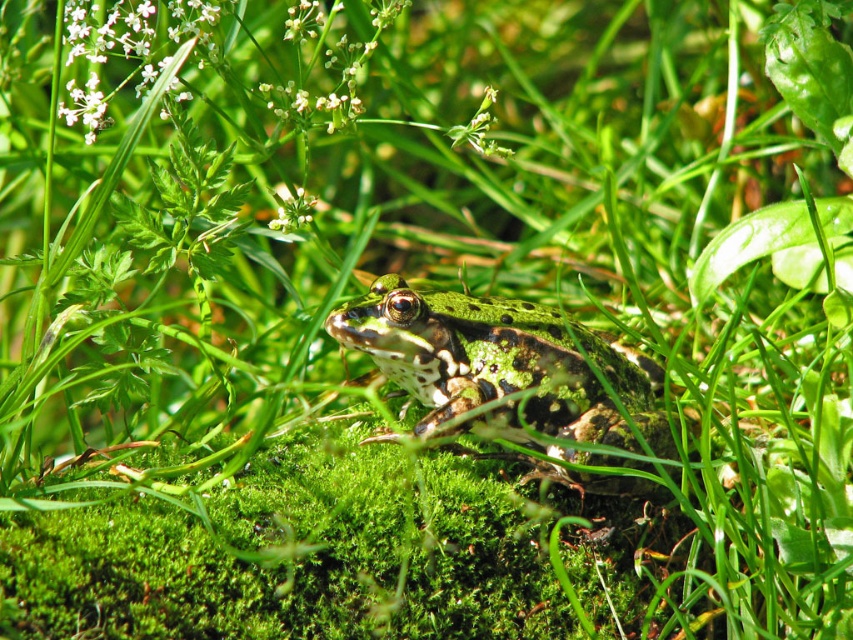
Question: Which point appears farthest from the camera in this image?

Choices:
 (A) (300, 212)
 (B) (555, 468)
 (C) (73, 12)

Answer: (A)

Question: Which point is farther to the camera?

Choices:
 (A) white fluffy flower at upper left
 (B) green spotted skin at center
 (C) green matte flower at upper center

Answer: (C)

Question: Does green spotted skin at center appear over green matte flower at upper center?

Choices:
 (A) yes
 (B) no

Answer: (B)

Question: Which object appears closest to the camera in this image?

Choices:
 (A) green spotted skin at center
 (B) white fluffy flower at upper left
 (C) green matte flower at upper center

Answer: (A)

Question: Does green spotted skin at center appear over green matte flower at upper center?

Choices:
 (A) no
 (B) yes

Answer: (A)

Question: Is green spotted skin at center positioned at the back of white fluffy flower at upper left?

Choices:
 (A) yes
 (B) no

Answer: (B)